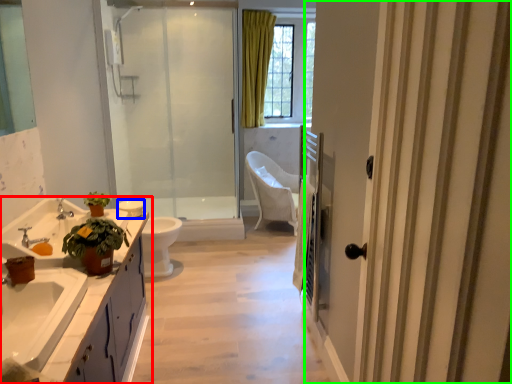
Question: Considering the real-world distances, which object is closest to bathroom cabinet (highlighted by a red box)? toilet bowl (highlighted by a blue box) or door (highlighted by a green box).

Choices:
 (A) toilet bowl
 (B) door

Answer: (A)